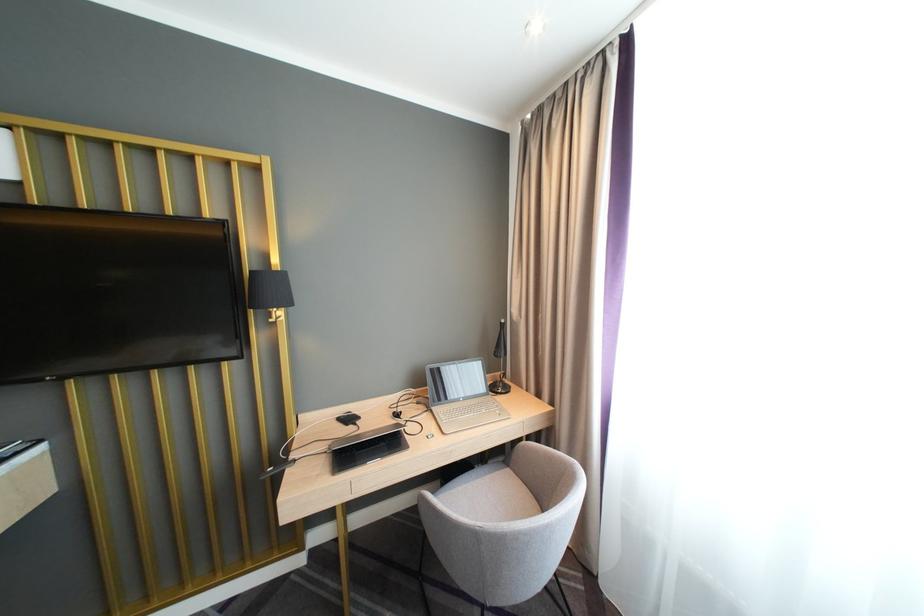
Find where to sit the chair sitting surface. Please return your answer as a coordinate pair (x, y).

(490, 496)